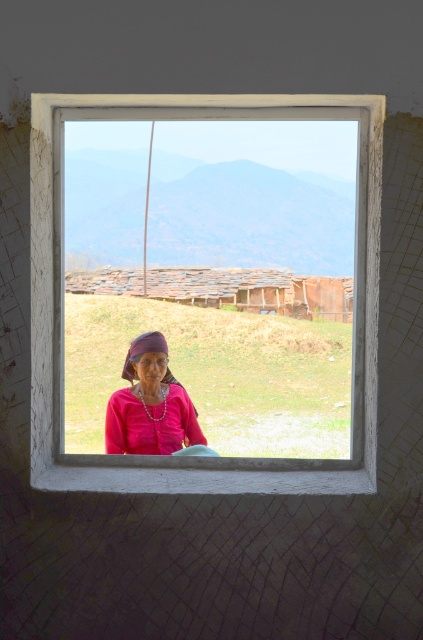
You are an interior designer assessing the space through the white wooden window frame at center. You notice the matte pink fabric at center is part of a decorative element. Considering their sizes, which object would dominate the visual focus in this composition?

The white wooden window frame at center has a greater height compared to the matte pink fabric at center, making it the dominant visual focus in the composition.

You are standing in front of a rustic building and see a white wooden window frame at center. Where exactly is the white wooden window frame at center located in relation to the point marked at coordinate (54, 332)?

The white wooden window frame at center is located exactly at the point marked at coordinate (54, 332).